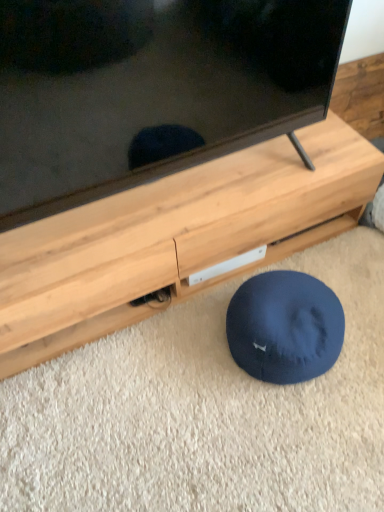
At what (x,y) coordinates should I click in order to perform the action: click on free space above wooden tv stand at center (from a real-world perspective). Please return your answer as a coordinate pair (x, y). Looking at the image, I should click on coord(171,200).